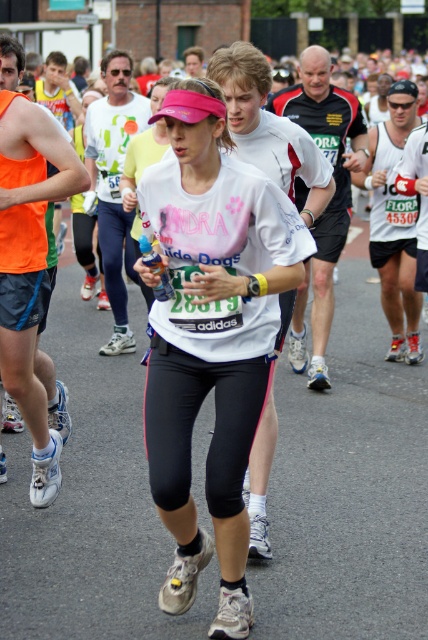
Does white matte running shirt at center have a lesser width compared to white matte tank top at center?

Yes, white matte running shirt at center is thinner than white matte tank top at center.

Is white matte running shirt at center bigger than white matte tank top at center?

Actually, white matte running shirt at center might be smaller than white matte tank top at center.

The width and height of the screenshot is (428, 640). Describe the element at coordinates (211, 337) in the screenshot. I see `white matte running shirt at center` at that location.

Find the location of a particular element. This screenshot has height=640, width=428. white matte running shirt at center is located at coordinates [x=211, y=337].

Who is more forward, (36,406) or (321,128)?

Positioned in front is point (36,406).

Does orange fabric tank top at left appear over black mesh shirt at center?

Actually, orange fabric tank top at left is below black mesh shirt at center.

Who is more distant from viewer, (23, 224) or (296, 323)?

The point (296, 323) is behind.

This screenshot has width=428, height=640. In order to click on orange fabric tank top at left in this screenshot , I will do `click(30, 272)`.

Looking at this image, can you confirm if white matte tank top at center is wider than matte white t-shirt at center?

Yes.

From the picture: Between white matte tank top at center and matte white t-shirt at center, which one is positioned higher?

matte white t-shirt at center

Who is more forward, (369,232) or (106,349)?

Positioned in front is point (369,232).

In order to click on white matte tank top at center in this screenshot , I will do `click(394, 221)`.